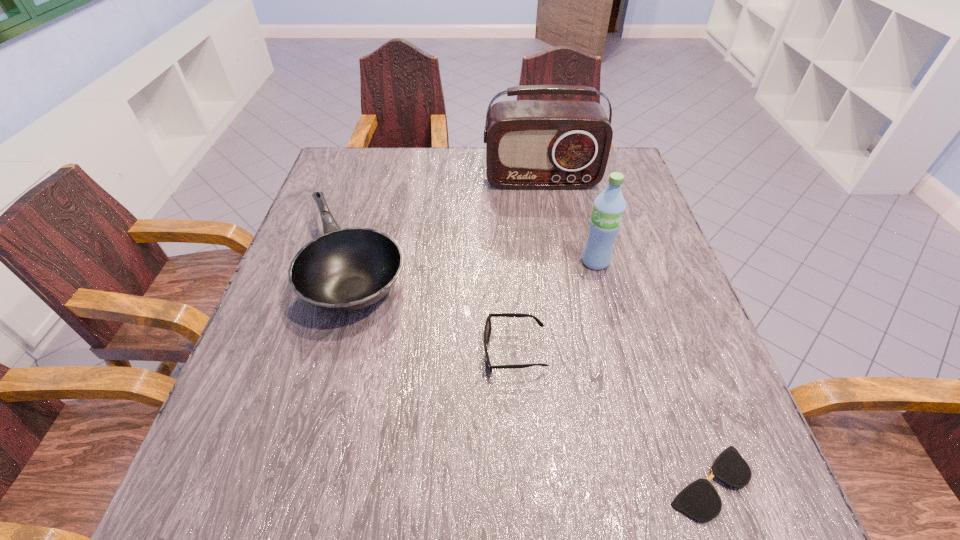
This screenshot has height=540, width=960. In order to click on free space that satisfies the following two spatial constraints: 1. on the front side of the spectacles; 2. on the left side of the water bottle in this screenshot , I will do `click(653, 483)`.

You are a GUI agent. You are given a task and a screenshot of the screen. Output one action in this format:
    pyautogui.click(x=<x>, y=<y>)
    Task: Click on the free space that satisfies the following two spatial constraints: 1. on the front panel of the shortest object; 2. on the left side of the farthest object
    
    Given the screenshot: What is the action you would take?
    pyautogui.click(x=593, y=483)

In order to click on free spot that satisfies the following two spatial constraints: 1. on the front side of the water bottle; 2. on the front-facing side of the second shortest object in this screenshot , I will do `click(619, 351)`.

I want to click on free space that satisfies the following two spatial constraints: 1. on the front panel of the radio receiver; 2. on the front-facing side of the sunglasses, so click(x=571, y=351).

I want to click on vacant space that satisfies the following two spatial constraints: 1. on the front panel of the water bottle; 2. on the right side of the farthest object, so click(556, 261).

The height and width of the screenshot is (540, 960). What are the coordinates of `free space that satisfies the following two spatial constraints: 1. on the front panel of the farthest object; 2. on the left side of the shortest object` in the screenshot? It's located at [x=593, y=483].

Locate an element on the screen. The image size is (960, 540). vacant space that satisfies the following two spatial constraints: 1. on the front-facing side of the second shortest object; 2. on the left side of the spectacles is located at coordinates (523, 483).

The width and height of the screenshot is (960, 540). What are the coordinates of `free space in the image that satisfies the following two spatial constraints: 1. on the front side of the nearest object; 2. on the left side of the leftmost object` in the screenshot? It's located at (297, 483).